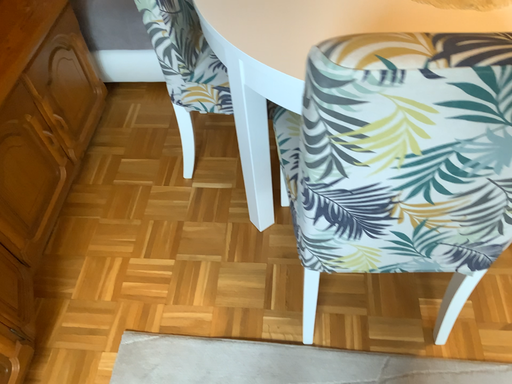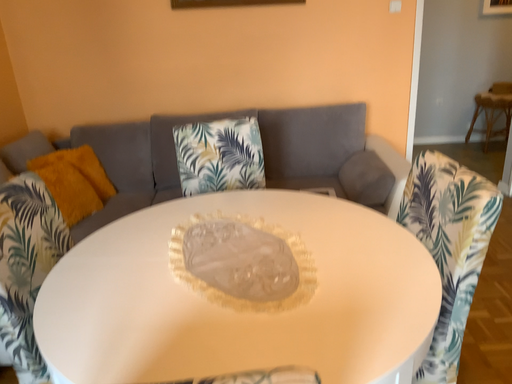
Question: Which way did the camera rotate in the video?

Choices:
 (A) rotated downward
 (B) rotated upward

Answer: (B)